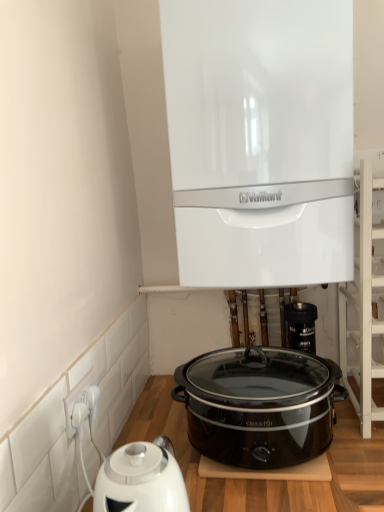
Question: Is black plastic valve at lower center located within white plastic socket at lower left?

Choices:
 (A) no
 (B) yes

Answer: (A)

Question: Can you confirm if white plastic socket at lower left is wider than black plastic valve at lower center?

Choices:
 (A) yes
 (B) no

Answer: (B)

Question: Considering the relative positions of white plastic socket at lower left and black plastic valve at lower center in the image provided, is white plastic socket at lower left to the left of black plastic valve at lower center from the viewer's perspective?

Choices:
 (A) yes
 (B) no

Answer: (A)

Question: From the image's perspective, would you say white plastic socket at lower left is shown under black plastic valve at lower center?

Choices:
 (A) yes
 (B) no

Answer: (A)

Question: Considering the relative sizes of white plastic socket at lower left and black plastic valve at lower center in the image provided, is white plastic socket at lower left bigger than black plastic valve at lower center?

Choices:
 (A) no
 (B) yes

Answer: (A)

Question: Does white plastic socket at lower left have a lesser height compared to black plastic valve at lower center?

Choices:
 (A) no
 (B) yes

Answer: (B)

Question: Is white wooden shelf at upper right closer to the viewer compared to white glossy boiler at upper center?

Choices:
 (A) no
 (B) yes

Answer: (A)

Question: Does white wooden shelf at upper right appear on the left side of white glossy boiler at upper center?

Choices:
 (A) no
 (B) yes

Answer: (A)

Question: Is white glossy boiler at upper center at the back of white wooden shelf at upper right?

Choices:
 (A) no
 (B) yes

Answer: (A)

Question: Can you confirm if white wooden shelf at upper right is bigger than white glossy boiler at upper center?

Choices:
 (A) yes
 (B) no

Answer: (B)

Question: Is white wooden shelf at upper right further to the viewer compared to white glossy boiler at upper center?

Choices:
 (A) yes
 (B) no

Answer: (A)

Question: Does white wooden shelf at upper right have a lesser height compared to white glossy boiler at upper center?

Choices:
 (A) no
 (B) yes

Answer: (B)

Question: Is black glossy slow cooker at center in front of white wooden shelf at upper right?

Choices:
 (A) yes
 (B) no

Answer: (A)